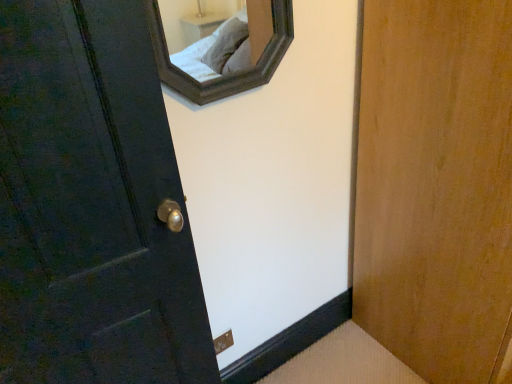
Locate an element on the screen. Image resolution: width=512 pixels, height=384 pixels. matte dark wood door at left is located at coordinates (91, 205).

This screenshot has width=512, height=384. What do you see at coordinates (91, 205) in the screenshot? I see `matte dark wood door at left` at bounding box center [91, 205].

Describe the element at coordinates (223, 342) in the screenshot. The width and height of the screenshot is (512, 384). I see `brown matte electric outlet at lower center` at that location.

Find the location of a particular element. brown matte electric outlet at lower center is located at coordinates (223, 342).

This screenshot has width=512, height=384. I want to click on matte dark wood door at left, so click(91, 205).

Is brown matte electric outlet at lower center to the left of matte dark wood door at left from the viewer's perspective?

In fact, brown matte electric outlet at lower center is to the right of matte dark wood door at left.

Is brown matte electric outlet at lower center positioned before matte dark wood door at left?

No, the depth of brown matte electric outlet at lower center is greater than that of matte dark wood door at left.

Considering the positions of points (213, 342) and (108, 340), is point (213, 342) closer to camera compared to point (108, 340)?

No.

From the image's perspective, would you say brown matte electric outlet at lower center is positioned over matte dark wood door at left?

No.

From a real-world perspective, is brown matte electric outlet at lower center below matte dark wood door at left?

Yes, from a real-world perspective, brown matte electric outlet at lower center is below matte dark wood door at left.

Considering the relative sizes of brown matte electric outlet at lower center and matte dark wood door at left in the image provided, is brown matte electric outlet at lower center thinner than matte dark wood door at left?

Yes, brown matte electric outlet at lower center is thinner than matte dark wood door at left.

Considering the sizes of brown matte electric outlet at lower center and matte dark wood door at left in the image, is brown matte electric outlet at lower center taller or shorter than matte dark wood door at left?

Clearly, brown matte electric outlet at lower center is shorter compared to matte dark wood door at left.

Looking at this image, is brown matte electric outlet at lower center bigger or smaller than matte dark wood door at left?

Considering their sizes, brown matte electric outlet at lower center takes up less space than matte dark wood door at left.

Is brown matte electric outlet at lower center spatially inside matte dark wood door at left, or outside of it?

brown matte electric outlet at lower center is not enclosed by matte dark wood door at left.

Is brown matte electric outlet at lower center not close to matte dark wood door at left?

They are positioned close to each other.

Looking at this image, is brown matte electric outlet at lower center oriented away from matte dark wood door at left?

brown matte electric outlet at lower center is not turned away from matte dark wood door at left.

How many degrees apart are the facing directions of brown matte electric outlet at lower center and matte dark wood door at left?

The angle between the facing direction of brown matte electric outlet at lower center and the facing direction of matte dark wood door at left is 6.39 degrees.

Find the location of `electric outlet below the matte dark wood door at left (from a real-world perspective)`. electric outlet below the matte dark wood door at left (from a real-world perspective) is located at coordinates [223, 342].

Is matte dark wood door at left at the right side of brown matte electric outlet at lower center?

No, matte dark wood door at left is not to the right of brown matte electric outlet at lower center.

Considering the relative positions of matte dark wood door at left and brown matte electric outlet at lower center in the image provided, is matte dark wood door at left in front of brown matte electric outlet at lower center?

Yes, the depth of matte dark wood door at left is less than that of brown matte electric outlet at lower center.

Which is less distant, (x=130, y=353) or (x=214, y=341)?

Point (x=130, y=353) appears to be closer to the viewer than point (x=214, y=341).

From the image's perspective, who appears lower, matte dark wood door at left or brown matte electric outlet at lower center?

brown matte electric outlet at lower center is shown below in the image.

From a real-world perspective, who is located lower, matte dark wood door at left or brown matte electric outlet at lower center?

From a 3D spatial view, brown matte electric outlet at lower center is below.

Can you confirm if matte dark wood door at left is thinner than brown matte electric outlet at lower center?

No.

Does matte dark wood door at left have a greater height compared to brown matte electric outlet at lower center?

Yes, matte dark wood door at left is taller than brown matte electric outlet at lower center.

Which of these two, matte dark wood door at left or brown matte electric outlet at lower center, is smaller?

brown matte electric outlet at lower center is smaller.

Is matte dark wood door at left completely or partially outside of brown matte electric outlet at lower center?

Yes, matte dark wood door at left is not within brown matte electric outlet at lower center.

Is the surface of matte dark wood door at left in direct contact with brown matte electric outlet at lower center?

No, matte dark wood door at left is not in contact with brown matte electric outlet at lower center.

Is matte dark wood door at left positioned with its back to brown matte electric outlet at lower center?

No.

The image size is (512, 384). I want to click on door that appears above the brown matte electric outlet at lower center (from a real-world perspective), so click(x=91, y=205).

Image resolution: width=512 pixels, height=384 pixels. I want to click on electric outlet located behind the matte dark wood door at left, so pos(223,342).

In the image, there is a brown matte electric outlet at lower center. Where is `door above it (from the image's perspective)`? The width and height of the screenshot is (512, 384). door above it (from the image's perspective) is located at coordinates (91, 205).